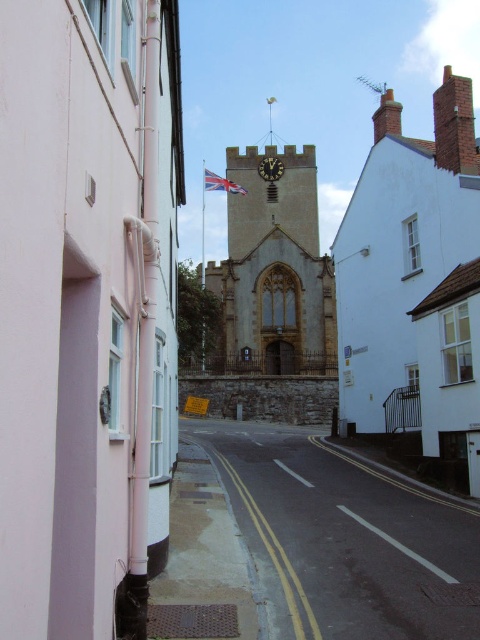
Is smooth asphalt road at center shorter than red fabric flag at center?

Yes.

Who is more forward, (x=455, y=604) or (x=225, y=179)?

Positioned in front is point (x=455, y=604).

At what (x,y) coordinates should I click in order to perform the action: click on smooth asphalt road at center. Please return your answer as a coordinate pair (x, y). This screenshot has width=480, height=640. Looking at the image, I should click on (346, 540).

Which is in front, point (328, 264) or point (273, 164)?

Positioned in front is point (328, 264).

Locate an element on the screen. stone clock tower at center is located at coordinates (275, 268).

Does white brick church at center have a greater width compared to gold metallic clock at center?

Correct, the width of white brick church at center exceeds that of gold metallic clock at center.

Between white brick church at center and gold metallic clock at center, which one appears on the right side from the viewer's perspective?

Positioned to the right is white brick church at center.

Who is more distant from viewer, (411, 209) or (279, 173)?

The point (279, 173) is more distant.

You are a GUI agent. You are given a task and a screenshot of the screen. Output one action in this format:
    pyautogui.click(x=<x>, y=<y>)
    Task: Click on the white brick church at center
    This screenshot has height=640, width=480.
    Given the screenshot: What is the action you would take?
    pyautogui.click(x=404, y=268)